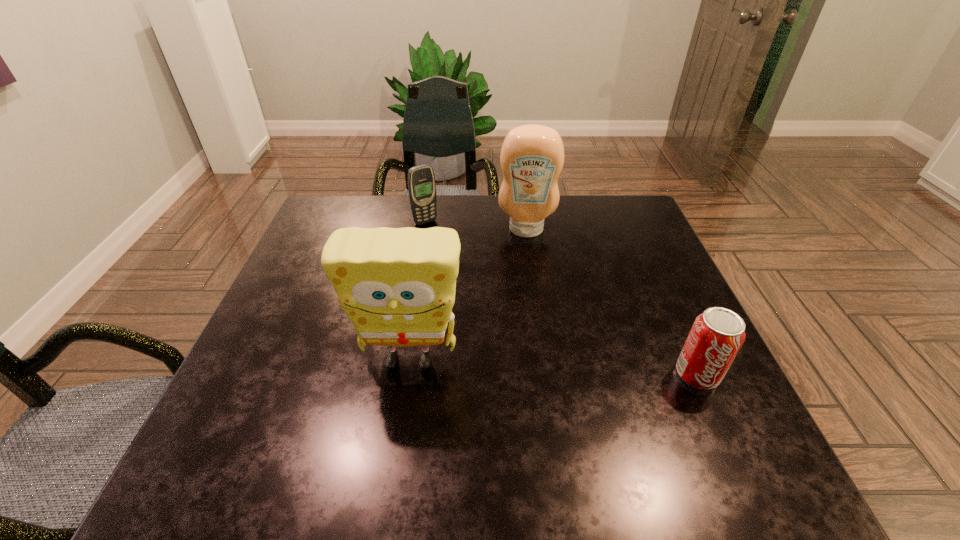
Where is `free space between the sponge and the rightmost object`? free space between the sponge and the rightmost object is located at coordinates (553, 367).

The image size is (960, 540). I want to click on unoccupied area between the shortest object and the cellular telephone, so click(562, 298).

Locate an element on the screen. This screenshot has width=960, height=540. the closest object to the shortest object is located at coordinates (397, 285).

This screenshot has width=960, height=540. Find the location of `object that is the second closest to the second object from right to left`. object that is the second closest to the second object from right to left is located at coordinates (397, 285).

At what (x,y) coordinates should I click in order to perform the action: click on free space that satisfies the following two spatial constraints: 1. on the front side of the second object from right to left; 2. on the right side of the cellular telephone. Please return your answer as a coordinate pair (x, y). Looking at the image, I should click on (424, 230).

In order to click on vacant space that satisfies the following two spatial constraints: 1. on the front side of the cellular telephone; 2. on the left side of the rightmost object in this screenshot , I will do `click(400, 374)`.

Find the location of a particular element. The height and width of the screenshot is (540, 960). vacant region that satisfies the following two spatial constraints: 1. on the face of the sponge; 2. on the right side of the rightmost object is located at coordinates (407, 374).

Find the location of a particular element. The height and width of the screenshot is (540, 960). vacant region that satisfies the following two spatial constraints: 1. on the front side of the soda can; 2. on the right side of the cellular telephone is located at coordinates (400, 374).